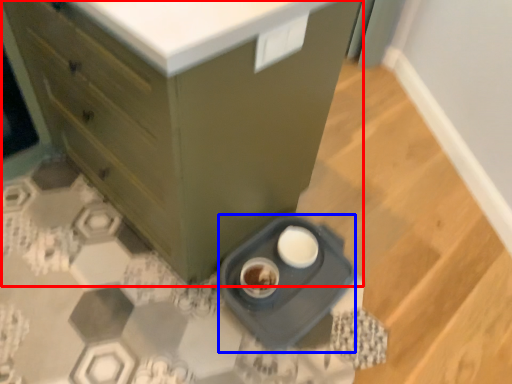
Question: Which point is closer to the camera, chest of drawers (highlighted by a red box) or appliance (highlighted by a blue box)?

Choices:
 (A) chest of drawers
 (B) appliance

Answer: (A)